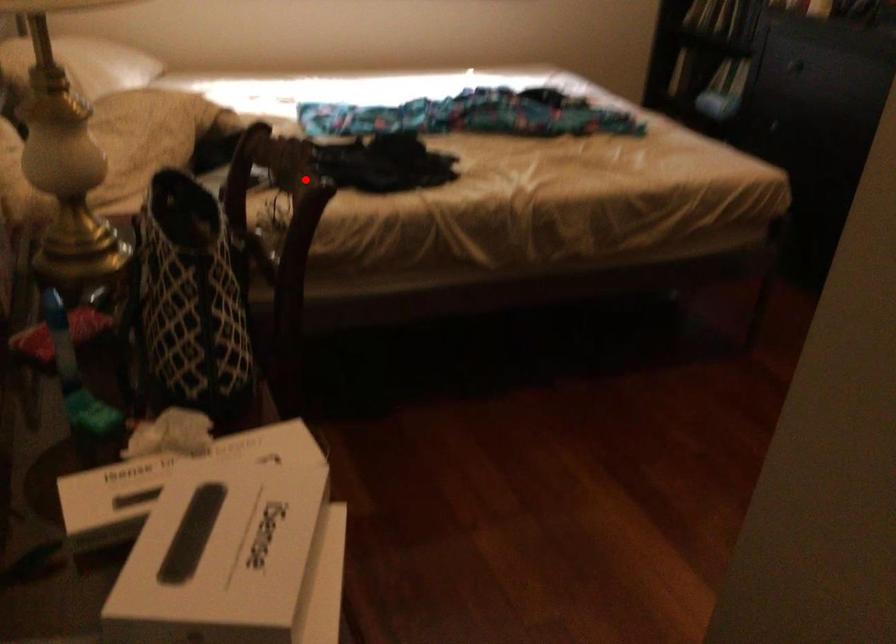
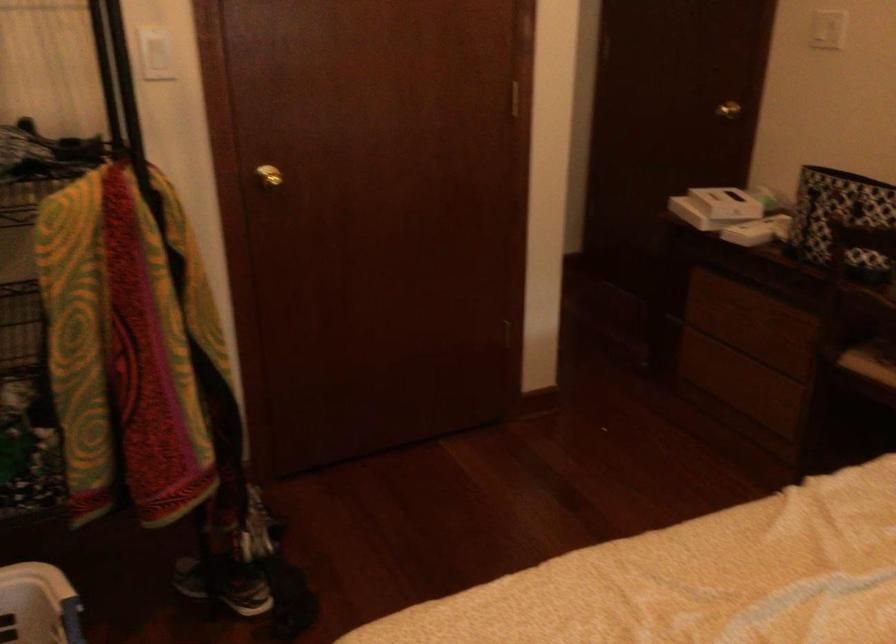
Question: I am providing you with two images of the same scene from different viewpoints. A red point is shown in image1. For the corresponding object point in image2, is it positioned nearer or farther from the camera?

Choices:
 (A) Nearer
 (B) Farther

Answer: (B)